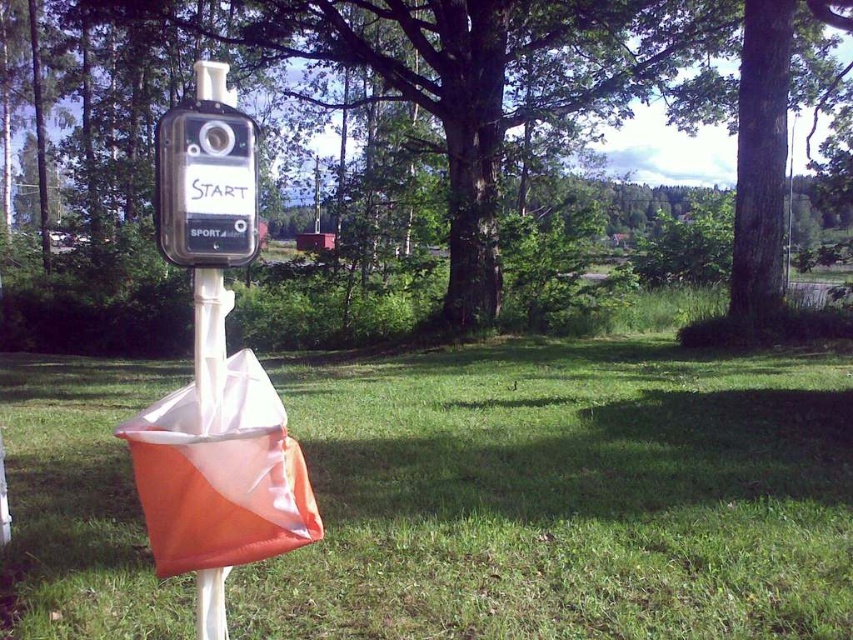
Question: Can you confirm if green grass at center is positioned above green leafy tree at center?

Choices:
 (A) yes
 (B) no

Answer: (B)

Question: Which object appears closest to the camera in this image?

Choices:
 (A) green leafy tree at center
 (B) green grass at center

Answer: (B)

Question: Is green grass at center to the right of green leafy tree at center from the viewer's perspective?

Choices:
 (A) yes
 (B) no

Answer: (B)

Question: Which object is closer to the camera taking this photo?

Choices:
 (A) green grass at center
 (B) green leafy tree at center

Answer: (A)

Question: Is green grass at center smaller than green leafy tree at center?

Choices:
 (A) no
 (B) yes

Answer: (A)